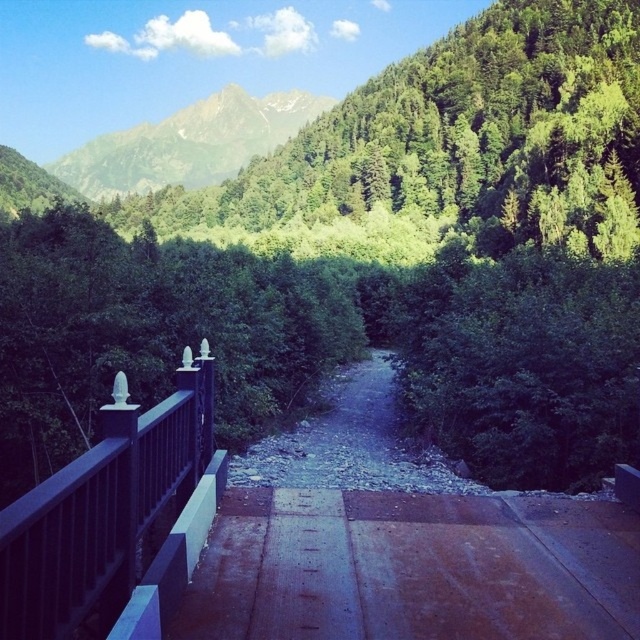
You are standing on the wooden bridge and want to locate two specific points marked in the image. Which of the two points, point (13, 566) or point (173, 124), is closer to you?

Point (13, 566) is closer to the viewer than point (173, 124).

You are standing on the wooden bridge and want to take a photo of the rustic wooden path at center and the green textured mountain at upper center. Which object will appear closer to the camera in the photo?

The rustic wooden path at center will appear closer to the camera in the photo because it is positioned in front of the green textured mountain at upper center.